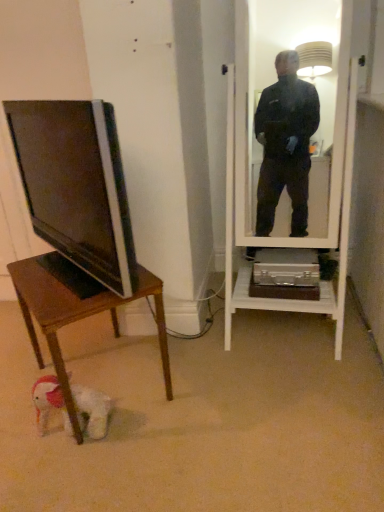
The image size is (384, 512). What do you see at coordinates (76, 185) in the screenshot? I see `matte black tv at left` at bounding box center [76, 185].

The image size is (384, 512). Identify the location of wooden desk at lower left. (77, 317).

Measure the distance between matte black tv at left and white plush dog at lower left.

A distance of 71.88 centimeters exists between matte black tv at left and white plush dog at lower left.

Is matte black tv at left to the right of white plush dog at lower left from the viewer's perspective?

In fact, matte black tv at left is to the left of white plush dog at lower left.

From a real-world perspective, between matte black tv at left and white plush dog at lower left, who is vertically higher?

matte black tv at left, from a real-world perspective.

Do you think matte black tv at left is within white plush dog at lower left, or outside of it?

matte black tv at left is located beyond the bounds of white plush dog at lower left.

Image resolution: width=384 pixels, height=512 pixels. I want to click on dog behind the wooden desk at lower left, so click(x=92, y=411).

Which of these two, wooden desk at lower left or white plush dog at lower left, is bigger?

Bigger between the two is wooden desk at lower left.

Does wooden desk at lower left touch white plush dog at lower left?

wooden desk at lower left and white plush dog at lower left are clearly separated.

Is wooden desk at lower left completely or partially outside of white plush dog at lower left?

Yes, wooden desk at lower left is not within white plush dog at lower left.

Can you see white plush dog at lower left touching wooden desk at lower left?

No, white plush dog at lower left is not in contact with wooden desk at lower left.

Choose the correct answer: Is white plush dog at lower left inside wooden desk at lower left or outside it?

white plush dog at lower left can be found inside wooden desk at lower left.

Which of these two, white plush dog at lower left or wooden desk at lower left, stands shorter?

With less height is white plush dog at lower left.

From a real-world perspective, which is physically below, white plush dog at lower left or wooden desk at lower left?

white plush dog at lower left is physically lower.

This screenshot has width=384, height=512. In order to click on television in front of the wooden desk at lower left in this screenshot , I will do `click(76, 185)`.

Considering the positions of objects matte black tv at left and wooden desk at lower left in the image provided, who is more to the right, matte black tv at left or wooden desk at lower left?

From the viewer's perspective, wooden desk at lower left appears more on the right side.

Is matte black tv at left further to the viewer compared to wooden desk at lower left?

No, it is in front of wooden desk at lower left.

Identify the location of dog below the matte black tv at left (from a real-world perspective). The width and height of the screenshot is (384, 512). (92, 411).

From a real-world perspective, is white plush dog at lower left positioned under matte black tv at left based on gravity?

Correct, in the physical world, white plush dog at lower left is lower than matte black tv at left.

Does white plush dog at lower left touch matte black tv at left?

white plush dog at lower left is not next to matte black tv at left, and they're not touching.

Does white plush dog at lower left have a lesser width compared to matte black tv at left?

Incorrect, the width of white plush dog at lower left is not less than that of matte black tv at left.

From a real-world perspective, between wooden desk at lower left and matte black tv at left, who is vertically higher?

matte black tv at left, from a real-world perspective.

In the scene shown: From the image's perspective, is wooden desk at lower left beneath matte black tv at left?

Yes, from the image's perspective, wooden desk at lower left is below matte black tv at left.

Is wooden desk at lower left positioned with its back to matte black tv at left?

That's not correct — wooden desk at lower left is not looking away from matte black tv at left.

Does wooden desk at lower left appear on the left side of matte black tv at left?

Incorrect, wooden desk at lower left is not on the left side of matte black tv at left.

You are a GUI agent. You are given a task and a screenshot of the screen. Output one action in this format:
    pyautogui.click(x=<x>, y=<y>)
    Task: Click on the television that is above the white plush dog at lower left (from a real-world perspective)
    This screenshot has height=512, width=384.
    Given the screenshot: What is the action you would take?
    pyautogui.click(x=76, y=185)

Identify the location of desk in front of the white plush dog at lower left. This screenshot has width=384, height=512. (77, 317).

From the image, which object appears to be nearer to white plush dog at lower left, matte black tv at left or wooden desk at lower left?

wooden desk at lower left.

Estimate the real-world distances between objects in this image. Which object is further from matte black tv at left, wooden desk at lower left or white plush dog at lower left?

white plush dog at lower left lies further to matte black tv at left than the other object.

Which object lies further to the anchor point wooden desk at lower left, white plush dog at lower left or matte black tv at left?

matte black tv at left.

Which object lies further to the anchor point wooden desk at lower left, matte black tv at left or white plush dog at lower left?

matte black tv at left lies further to wooden desk at lower left than the other object.

From the image, which object appears to be farther from matte black tv at left, white plush dog at lower left or wooden desk at lower left?

white plush dog at lower left.

Which object lies further to the anchor point white plush dog at lower left, wooden desk at lower left or matte black tv at left?

The object further to white plush dog at lower left is matte black tv at left.

You are a GUI agent. You are given a task and a screenshot of the screen. Output one action in this format:
    pyautogui.click(x=<x>, y=<y>)
    Task: Click on the desk between matte black tv at left and white plush dog at lower left in the up-down direction
    This screenshot has width=384, height=512.
    Given the screenshot: What is the action you would take?
    pyautogui.click(x=77, y=317)